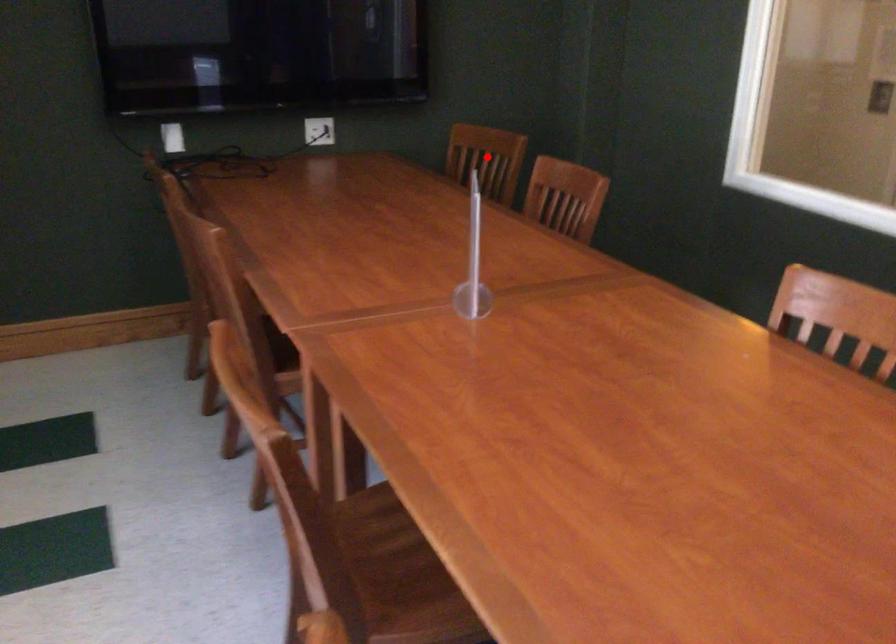
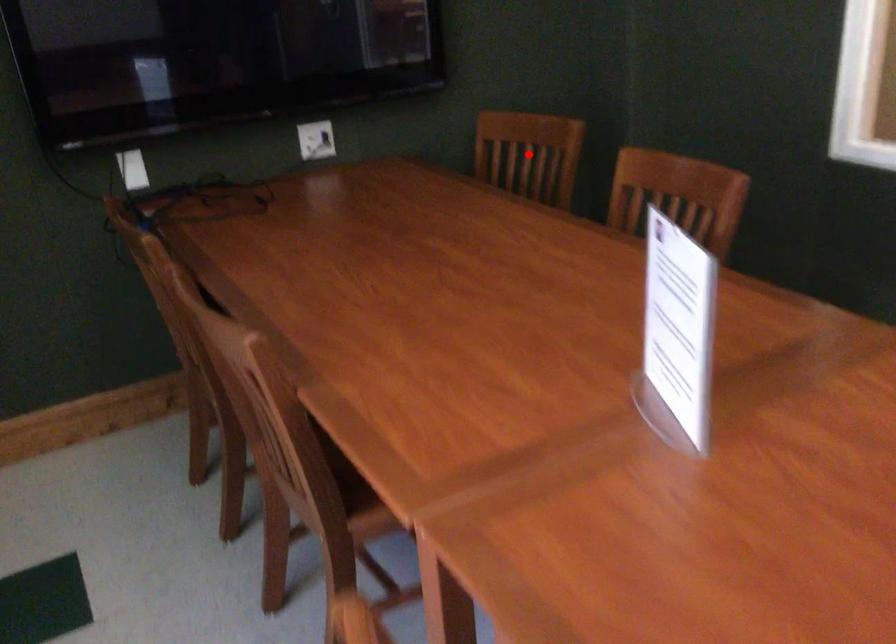
I am providing you with two images of the same scene from different viewpoints. A red point is marked on the first image and another point is marked on the second image. Is the marked point in image1 the same physical position as the marked point in image2?

Yes